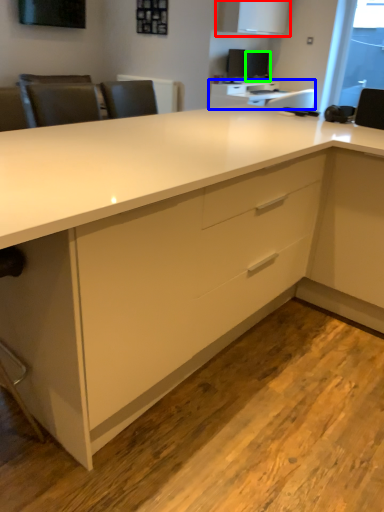
Question: Which object is the farthest from cabinetry (highlighted by a red box)? Choose among these: table (highlighted by a blue box) or computer monitor (highlighted by a green box).

Choices:
 (A) table
 (B) computer monitor

Answer: (A)